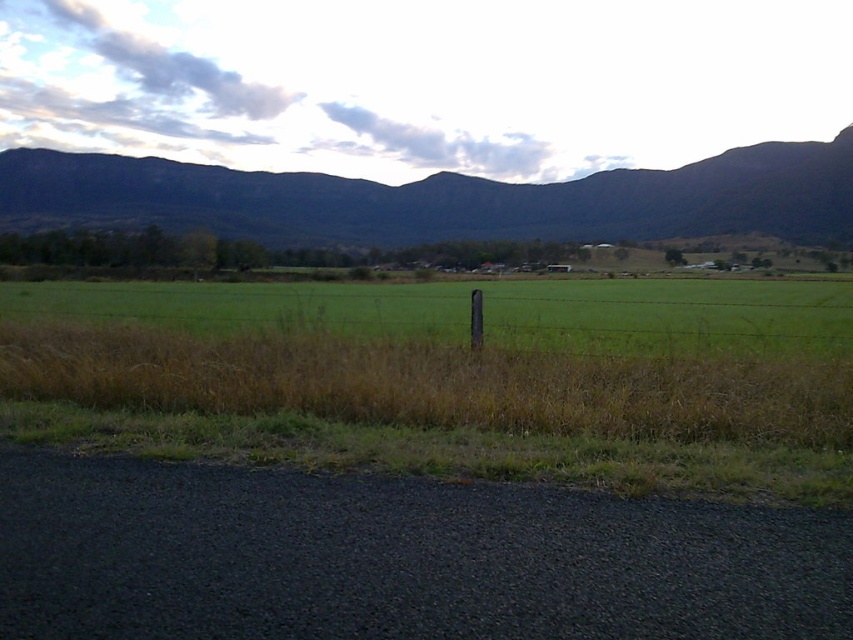
You are standing at the point labeled as point (461, 376) in the image. Based on the scene description, what object or feature are you most likely standing on?

The point (461, 376) corresponds to green grass at center, so you are most likely standing on the green grass at center.

You are standing on the gravel road in the foreground and want to walk towards the green grassy field at center. Which direction should you walk to avoid the dark green forested mountain at upper center?

You should walk towards the green grassy field at center, which is closer to you than the dark green forested mountain at upper center, so moving towards the field will avoid the mountain.